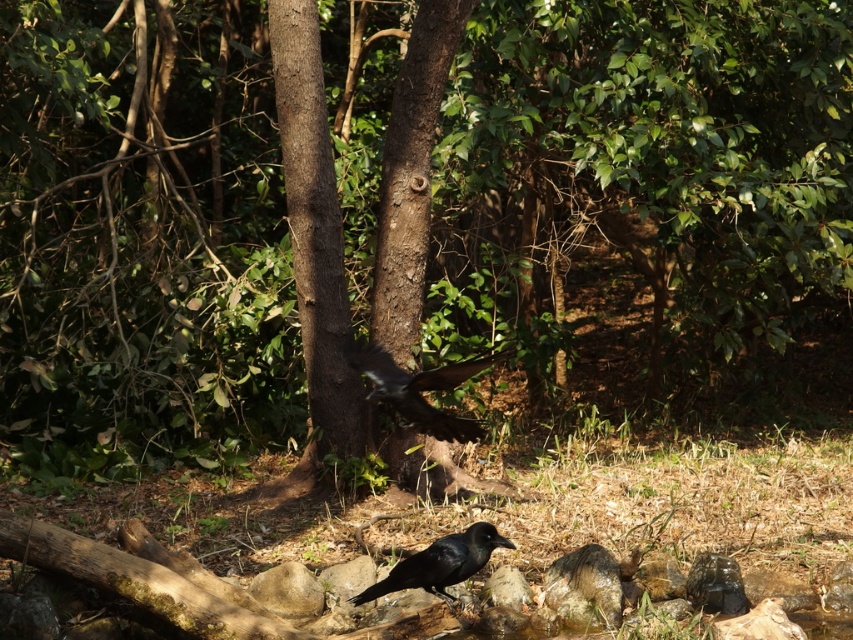
Can you confirm if shiny black raven at center is taller than shiny black raven at lower center?

Indeed, shiny black raven at center has a greater height compared to shiny black raven at lower center.

Can you confirm if shiny black raven at center is shorter than shiny black raven at lower center?

No.

Where is `shiny black raven at center`? This screenshot has height=640, width=853. shiny black raven at center is located at coordinates (419, 388).